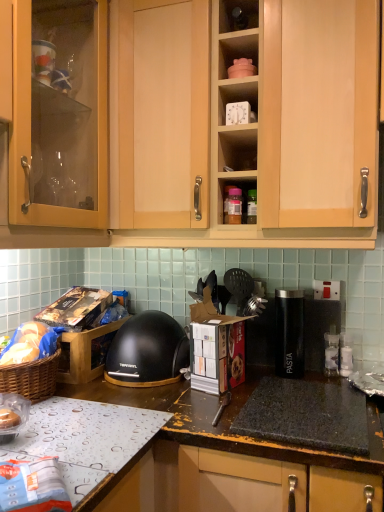
This screenshot has width=384, height=512. In order to click on free spot above metallic silver tray at lower left (from a real-world perspective) in this screenshot , I will do `click(76, 422)`.